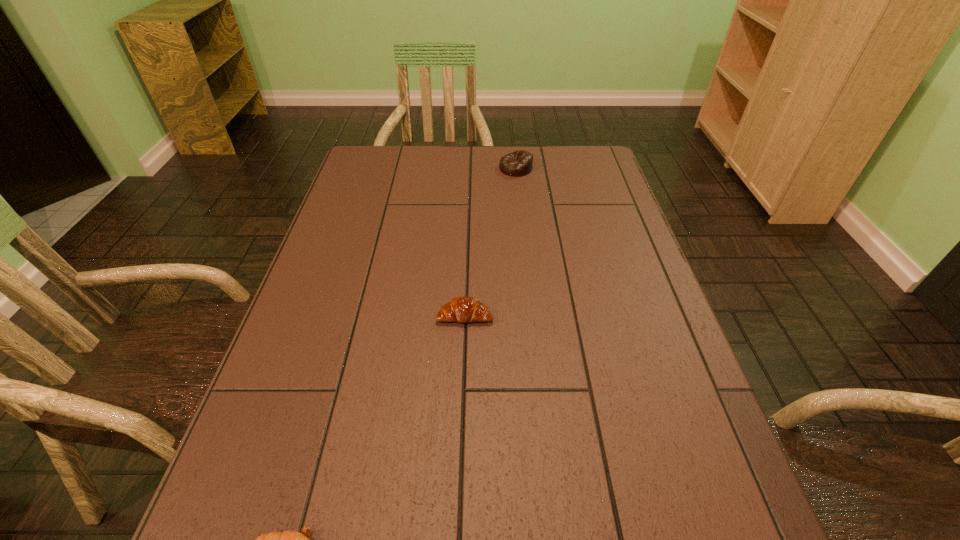
Where is `beanbag`? The height and width of the screenshot is (540, 960). beanbag is located at coordinates (518, 163).

I want to click on the tallest object, so click(518, 163).

You are a GUI agent. You are given a task and a screenshot of the screen. Output one action in this format:
    pyautogui.click(x=<x>, y=<y>)
    Task: Click on the right crescent roll
    The height and width of the screenshot is (540, 960).
    Given the screenshot: What is the action you would take?
    pyautogui.click(x=461, y=309)

This screenshot has width=960, height=540. What are the coordinates of `the second object from right to left` in the screenshot? It's located at (461, 309).

You are a GUI agent. You are given a task and a screenshot of the screen. Output one action in this format:
    pyautogui.click(x=<x>, y=<y>)
    Task: Click on the vacant area situated on the left of the beanbag
    This screenshot has height=540, width=960.
    Given the screenshot: What is the action you would take?
    pyautogui.click(x=441, y=168)

Locate an element on the screen. This screenshot has height=540, width=960. vacant space located 0.260m on the left of the farther crescent roll is located at coordinates (320, 315).

You are a GUI agent. You are given a task and a screenshot of the screen. Output one action in this format:
    pyautogui.click(x=<x>, y=<y>)
    Task: Click on the object that is at the far edge
    The image size is (960, 540).
    Given the screenshot: What is the action you would take?
    (x=518, y=163)

This screenshot has width=960, height=540. Identify the location of vacant region at the far edge. (x=535, y=173).

This screenshot has height=540, width=960. In the image, there is a desktop. Find the location of `vacant area at the left edge`. vacant area at the left edge is located at coordinates (294, 345).

This screenshot has width=960, height=540. I want to click on free space at the right edge, so click(618, 285).